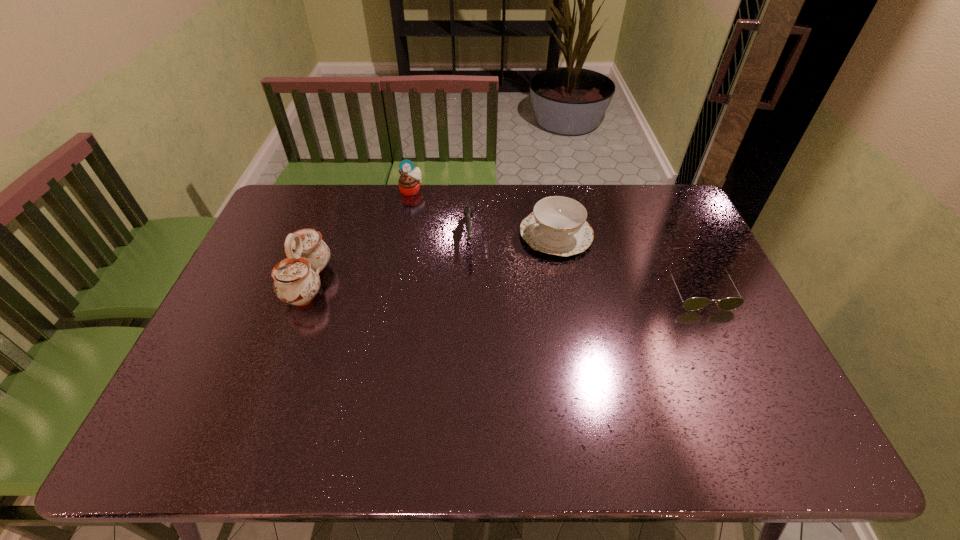
Identify the location of vacant spot on the desktop that is between the taller chinaware and the shortest object and is positioned aiming along the barrel of the gun. The height and width of the screenshot is (540, 960). (471, 286).

Image resolution: width=960 pixels, height=540 pixels. In order to click on free space on the desktop that is between the left chinaware and the rightmost object and is positioned on the handle side of the right chinaware in this screenshot , I will do `click(455, 286)`.

At what (x,y) coordinates should I click in order to perform the action: click on vacant spot on the desktop that is between the leftmost object and the sunglasses and is positioned on the front-facing side of the second object from left to right. Please return your answer as a coordinate pair (x, y). The image size is (960, 540). Looking at the image, I should click on (472, 286).